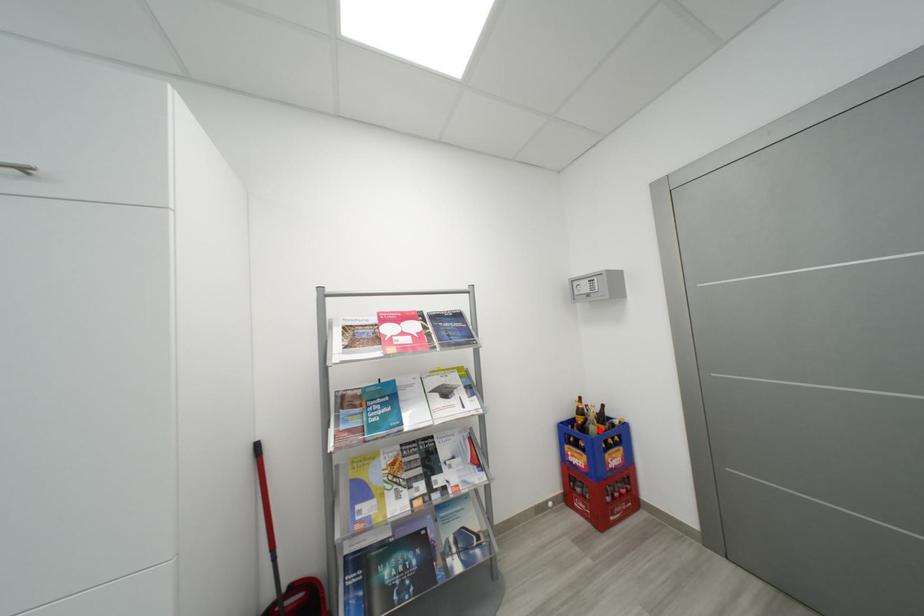
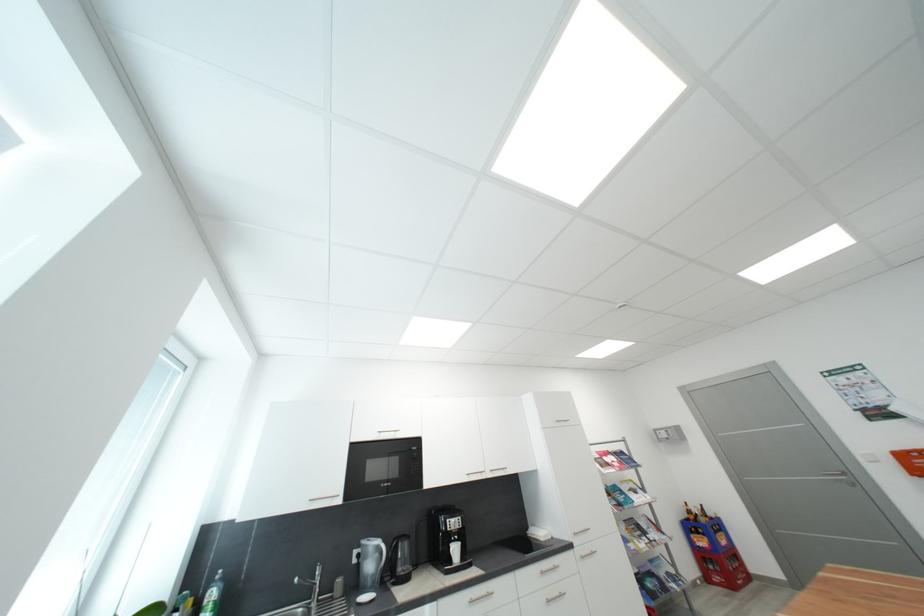
Question: I am providing you with two images of the same scene from different viewpoints. A red point is marked on the first image. At the location where the point appears in image 1, is it still visible in image 2?

Choices:
 (A) Yes
 (B) No

Answer: (A)